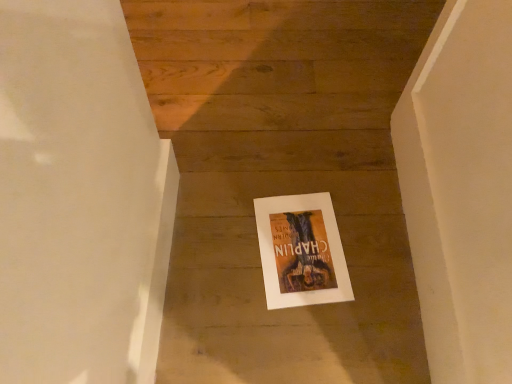
The height and width of the screenshot is (384, 512). Find the location of `blank space situated above white paper at center (from a real-world perspective)`. blank space situated above white paper at center (from a real-world perspective) is located at coordinates (296, 242).